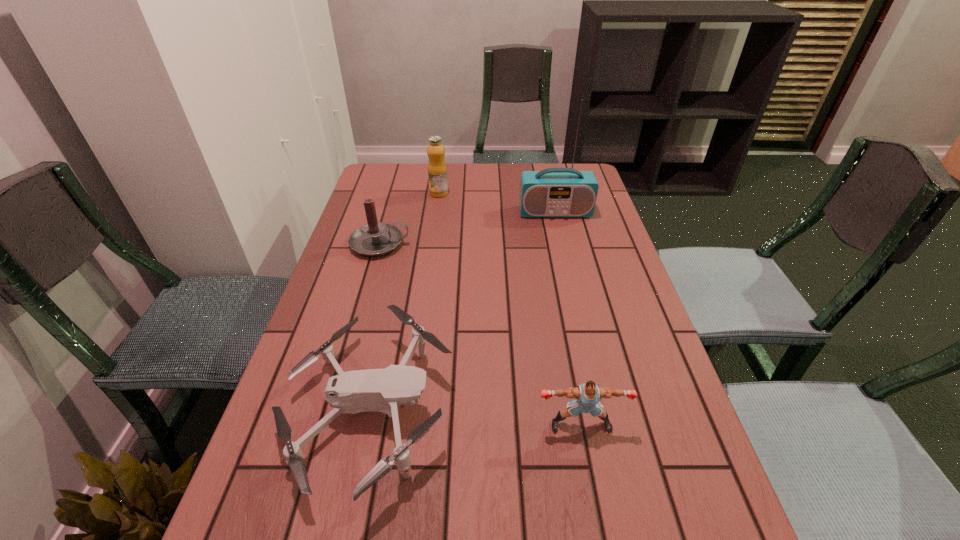
Locate an element on the screen. vacant area that satisfies the following two spatial constraints: 1. on the front label of the second tallest object; 2. with a camera at the front of the drone is located at coordinates (409, 413).

This screenshot has height=540, width=960. What are the coordinates of `free space that satisfies the following two spatial constraints: 1. on the front label of the farthest object; 2. with a camera at the front of the drone` in the screenshot? It's located at (409, 413).

Where is `vacant area in the image that satisfies the following two spatial constraints: 1. on the front label of the farthest object; 2. on the side of the third farthest object with the handle loop`? Image resolution: width=960 pixels, height=540 pixels. vacant area in the image that satisfies the following two spatial constraints: 1. on the front label of the farthest object; 2. on the side of the third farthest object with the handle loop is located at coordinates (432, 244).

The image size is (960, 540). I want to click on vacant space that satisfies the following two spatial constraints: 1. on the front label of the farthest object; 2. with a camera at the front of the drone, so click(x=409, y=413).

At what (x,y) coordinates should I click in order to perform the action: click on vacant region that satisfies the following two spatial constraints: 1. on the front panel of the radio receiver; 2. with a camera at the front of the drone. Please return your answer as a coordinate pair (x, y). The height and width of the screenshot is (540, 960). Looking at the image, I should click on (602, 413).

Image resolution: width=960 pixels, height=540 pixels. Identify the location of free spot that satisfies the following two spatial constraints: 1. on the front panel of the second farthest object; 2. on the side of the candle with the handle loop. (563, 244).